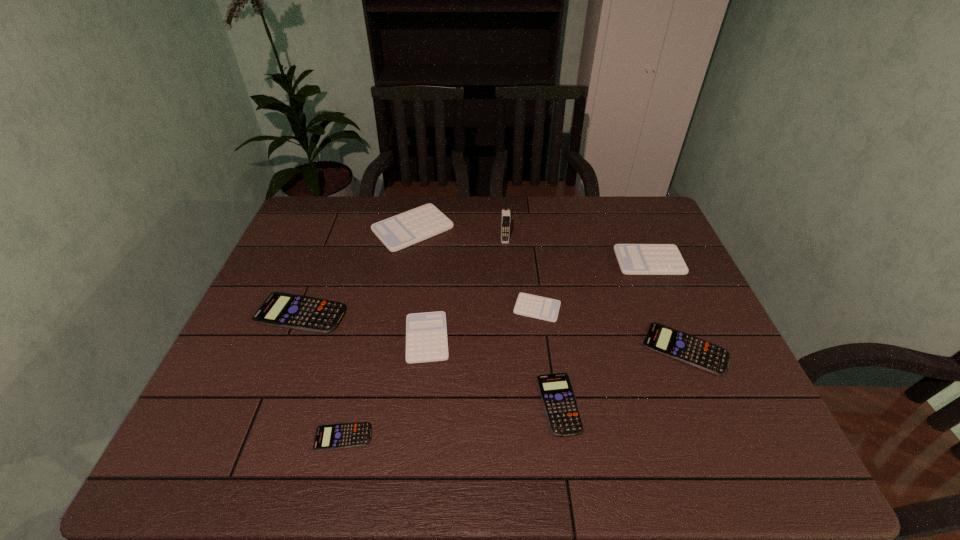
You are a GUI agent. You are given a task and a screenshot of the screen. Output one action in this format:
    pyautogui.click(x=<x>, y=<y>)
    Task: Click on the tallest object
    
    Given the screenshot: What is the action you would take?
    pyautogui.click(x=505, y=217)

Where is `the biggest white calculator`? The height and width of the screenshot is (540, 960). the biggest white calculator is located at coordinates (403, 230).

Identify the location of the tallest calculator. (403, 230).

Locate an element on the screen. the rightmost white calculator is located at coordinates (634, 259).

Find the location of a particular element. The width and height of the screenshot is (960, 540). the third smallest white calculator is located at coordinates (634, 259).

Find the location of `the third biggest white calculator`. the third biggest white calculator is located at coordinates (426, 333).

Where is `the leftmost object`? The height and width of the screenshot is (540, 960). the leftmost object is located at coordinates (305, 313).

Locate an element on the screen. This screenshot has height=540, width=960. the biggest blue calculator is located at coordinates (305, 313).

Locate an element on the screen. This screenshot has height=540, width=960. the smallest white calculator is located at coordinates (533, 306).

What are the coordinates of `the rightmost blue calculator` in the screenshot? It's located at (670, 342).